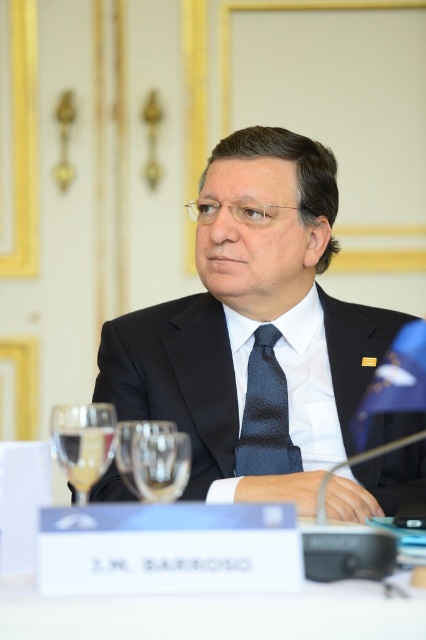
Question: Can you confirm if black silk suit at center is thinner than white satin dress shirt at center?

Choices:
 (A) yes
 (B) no

Answer: (B)

Question: Which of the following is the closest to the observer?

Choices:
 (A) pos(319,392)
 (B) pos(166,333)

Answer: (A)

Question: Which of these objects is positioned farthest from the white satin dress shirt at center?

Choices:
 (A) transparent glass at center
 (B) black silk suit at center

Answer: (A)

Question: Does white satin dress shirt at center have a smaller size compared to dark blue textured tie at center?

Choices:
 (A) no
 (B) yes

Answer: (A)

Question: Can you confirm if dark blue textured tie at center is positioned below transparent glass at center?

Choices:
 (A) yes
 (B) no

Answer: (B)

Question: Which object is closer to the camera taking this photo?

Choices:
 (A) dark blue textured tie at center
 (B) white satin dress shirt at center
 (C) transparent glass at center

Answer: (C)